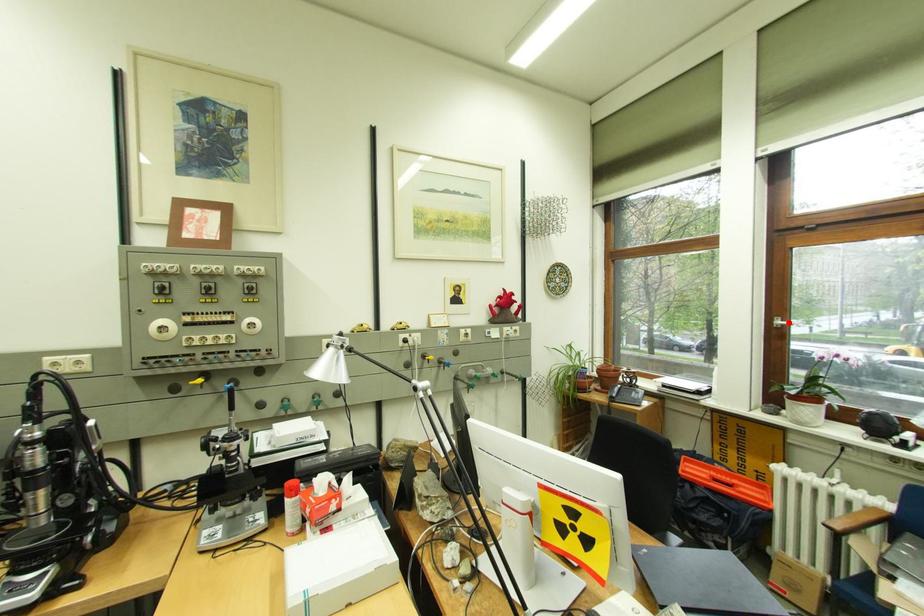
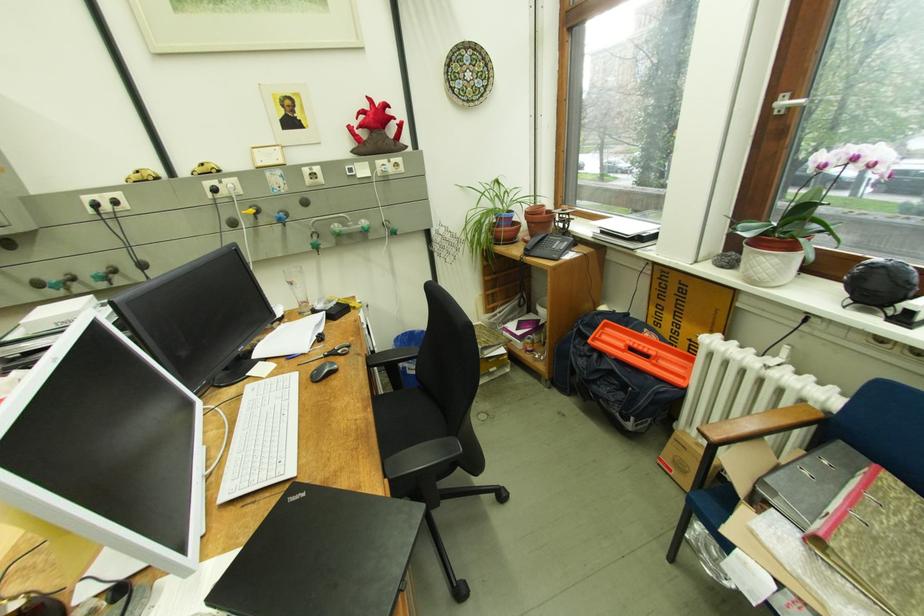
Find the pixel in the second image that matches the highlighted location in the first image.

(794, 103)